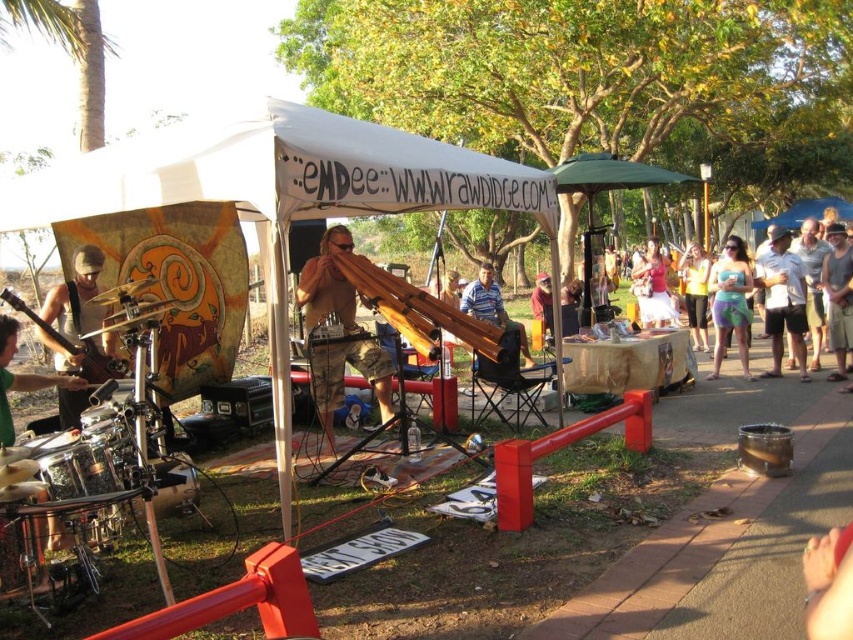
You are attending an outdoor festival and see a musician performing under a white canopy tent. The musician is holding a wooden flute at center. Where exactly is the wooden flute positioned relative to the tent?

The wooden flute at center is located at point 0.592 on the x axis and 0.402 on the y axis, which places it precisely at the center of the tent.

You are a photographer at the event and want to capture both the wooden flute at center and the green fabric drum at left in a single shot. Given that your camera has a fixed focal length, which object should you position closer to the camera to ensure both fit in the frame?

The wooden flute at center is bigger than the green fabric drum at left. To ensure both fit in the frame, position the green fabric drum at left closer to the camera since it is smaller and requires less space, allowing the larger wooden flute at center to be placed further back but still within the frame.